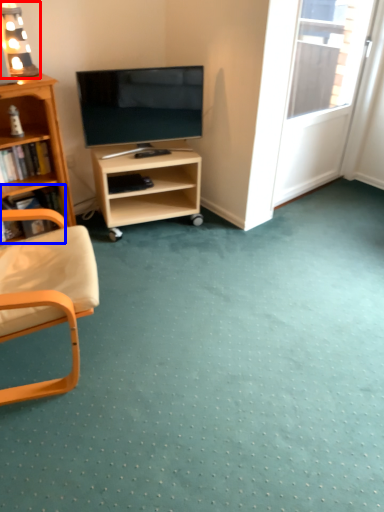
Question: Which point is further to the camera, lamp (highlighted by a red box) or book (highlighted by a blue box)?

Choices:
 (A) lamp
 (B) book

Answer: (B)